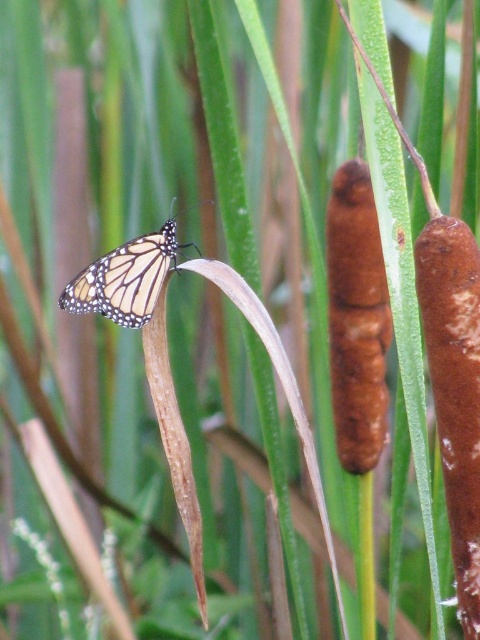
Is brown fuzzy caterpillar at center-right wider than translucent orange butterfly at center?

No, brown fuzzy caterpillar at center-right is not wider than translucent orange butterfly at center.

Who is positioned more to the left, brown fuzzy caterpillar at center-right or translucent orange butterfly at center?

translucent orange butterfly at center

Locate an element on the screen. brown fuzzy caterpillar at center-right is located at coordinates (357, 317).

I want to click on brown fuzzy caterpillar at center-right, so pyautogui.click(x=357, y=317).